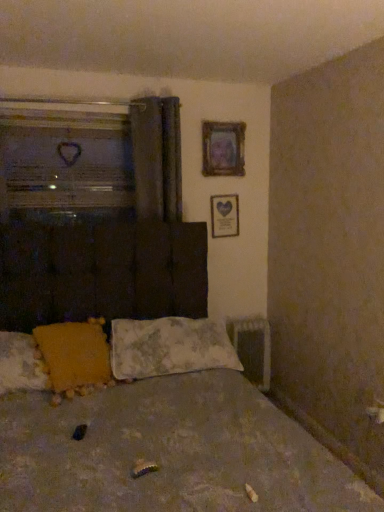
Question: Is textured fabric bed at center not within yellow fabric pillow at lower left, which is the 2th pillow in right-to-left order?

Choices:
 (A) yes
 (B) no

Answer: (A)

Question: Does textured fabric bed at center have a greater width compared to yellow fabric pillow at lower left, which is the 2th pillow in right-to-left order?

Choices:
 (A) no
 (B) yes

Answer: (B)

Question: Is yellow fabric pillow at lower left, which is counted as the first pillow, starting from the left, surrounded by textured fabric bed at center?

Choices:
 (A) yes
 (B) no

Answer: (A)

Question: Is textured fabric bed at center thinner than yellow fabric pillow at lower left, which is counted as the first pillow, starting from the left?

Choices:
 (A) yes
 (B) no

Answer: (B)

Question: Does textured fabric bed at center lie in front of yellow fabric pillow at lower left, which is the 2th pillow in right-to-left order?

Choices:
 (A) yes
 (B) no

Answer: (A)

Question: Can you see textured fabric bed at center touching yellow fabric pillow at lower left, which is the 2th pillow in right-to-left order?

Choices:
 (A) yes
 (B) no

Answer: (B)

Question: Considering the relative positions of wooden frame at upper center, the first picture frame positioned from the top, and textured fabric bed at center in the image provided, is wooden frame at upper center, the first picture frame positioned from the top, to the left of textured fabric bed at center from the viewer's perspective?

Choices:
 (A) no
 (B) yes

Answer: (A)

Question: Is wooden frame at upper center, arranged as the 2th picture frame when ordered from the bottom, shorter than textured fabric bed at center?

Choices:
 (A) yes
 (B) no

Answer: (A)

Question: From a real-world perspective, is wooden frame at upper center, arranged as the 2th picture frame when ordered from the bottom, located higher than textured fabric bed at center?

Choices:
 (A) yes
 (B) no

Answer: (A)

Question: Is wooden frame at upper center, the first picture frame positioned from the top, bigger than textured fabric bed at center?

Choices:
 (A) no
 (B) yes

Answer: (A)

Question: Is wooden frame at upper center, arranged as the 2th picture frame when ordered from the bottom, to the right of textured fabric bed at center from the viewer's perspective?

Choices:
 (A) yes
 (B) no

Answer: (A)

Question: Is wooden frame at upper center, arranged as the 2th picture frame when ordered from the bottom, not inside textured fabric bed at center?

Choices:
 (A) no
 (B) yes

Answer: (B)

Question: Does transparent glass heart at upper left have a lesser width compared to wooden heart-shaped frame at upper right, which appears as the 2th picture frame when viewed from the top?

Choices:
 (A) yes
 (B) no

Answer: (B)